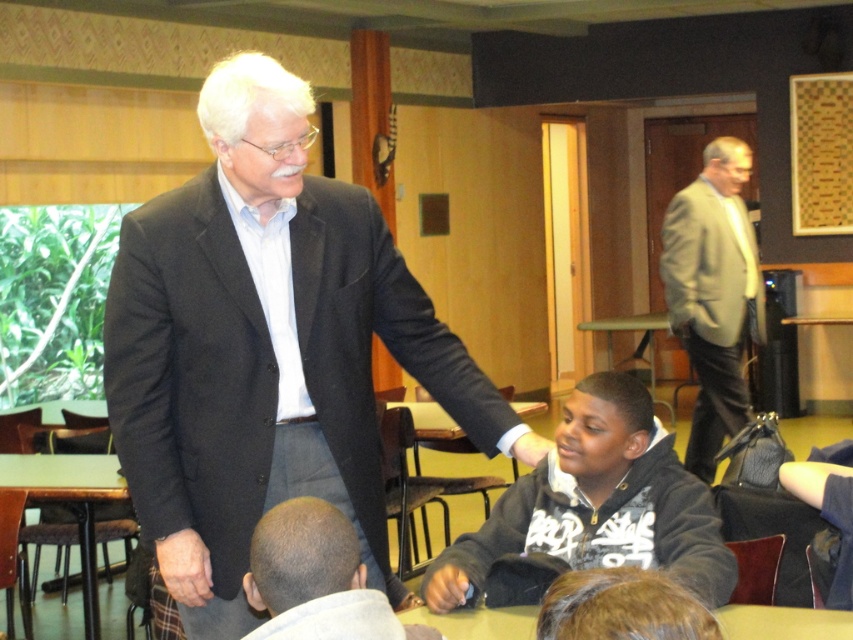
Is dark gray suit at center further to the viewer compared to light gray suit at right?

No, it is not.

Which is behind, point (218, 184) or point (724, 323)?

Positioned behind is point (724, 323).

Between point (378, 525) and point (688, 248), which one is positioned behind?

Point (688, 248)

Where is `dark gray suit at center`? The height and width of the screenshot is (640, 853). dark gray suit at center is located at coordinates (267, 349).

Consider the image. Which is above, dark gray suit at center or bald head at lower center?

dark gray suit at center is higher up.

Does point (445, 387) lie behind point (397, 636)?

Yes, point (445, 387) is behind point (397, 636).

Locate an element on the screen. The image size is (853, 640). dark gray suit at center is located at coordinates (267, 349).

Which is more to the left, black fleece jacket at lower center or light gray suit at right?

Positioned to the left is black fleece jacket at lower center.

Is black fleece jacket at lower center in front of light gray suit at right?

Yes, it is in front of light gray suit at right.

Image resolution: width=853 pixels, height=640 pixels. Find the location of `black fleece jacket at lower center`. black fleece jacket at lower center is located at coordinates (598, 502).

Locate an element on the screen. This screenshot has width=853, height=640. black fleece jacket at lower center is located at coordinates (598, 502).